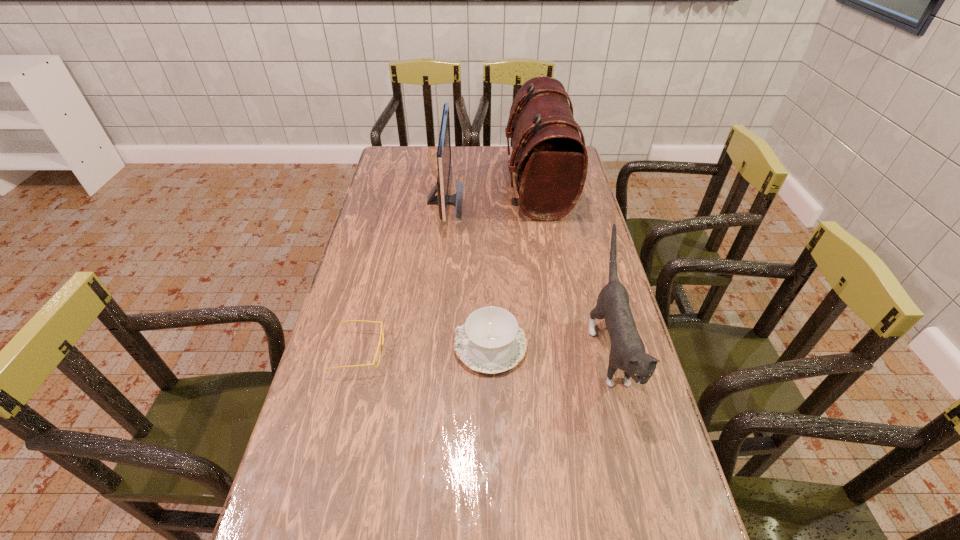
What are the coordinates of `object that is positioned at the far right corner` in the screenshot? It's located at (549, 158).

In the image, there is a desktop. Where is `vacant space at the far edge`? This screenshot has height=540, width=960. vacant space at the far edge is located at coordinates (503, 155).

Find the location of a particular element. Image resolution: width=960 pixels, height=540 pixels. vacant area at the left edge of the desktop is located at coordinates (378, 239).

This screenshot has width=960, height=540. In the image, there is a desktop. Find the location of `vacant space at the right edge`. vacant space at the right edge is located at coordinates (626, 478).

In the image, there is a desktop. Where is `vacant area at the far left corner`? The image size is (960, 540). vacant area at the far left corner is located at coordinates (389, 157).

At what (x,y) coordinates should I click in order to perform the action: click on free space between the monitor and the shortest object. Please return your answer as a coordinate pair (x, y). The image size is (960, 540). Looking at the image, I should click on coord(402,276).

At what (x,y) coordinates should I click in order to perform the action: click on vacant space that's between the fourth tallest object and the satchel. Please return your answer as a coordinate pair (x, y). Image resolution: width=960 pixels, height=540 pixels. Looking at the image, I should click on (514, 265).

Locate an element on the screen. This screenshot has height=540, width=960. vacant region between the shortest object and the satchel is located at coordinates (448, 268).

I want to click on blank region between the spectacles and the satchel, so click(448, 268).

This screenshot has width=960, height=540. I want to click on vacant space in between the cat and the monitor, so click(527, 276).